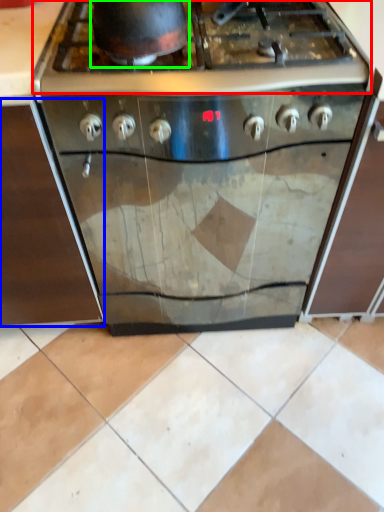
Question: Based on their relative distances, which object is nearer to gas stove (highlighted by a red box)? Choose from cabinetry (highlighted by a blue box) and wok (highlighted by a green box).

Choices:
 (A) cabinetry
 (B) wok

Answer: (B)